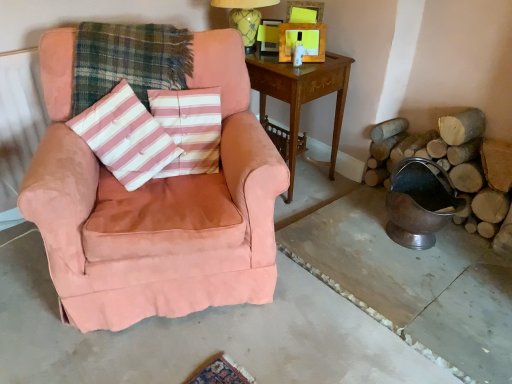
Image resolution: width=512 pixels, height=384 pixels. Find the location of `vacant area that lies to the right of polished silver swivel chair at lower right`. vacant area that lies to the right of polished silver swivel chair at lower right is located at coordinates (473, 247).